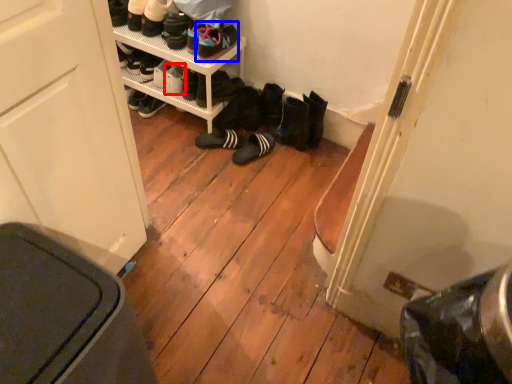
Question: Among these objects, which one is nearest to the camera, footwear (highlighted by a red box) or footwear (highlighted by a blue box)?

Choices:
 (A) footwear
 (B) footwear

Answer: (B)